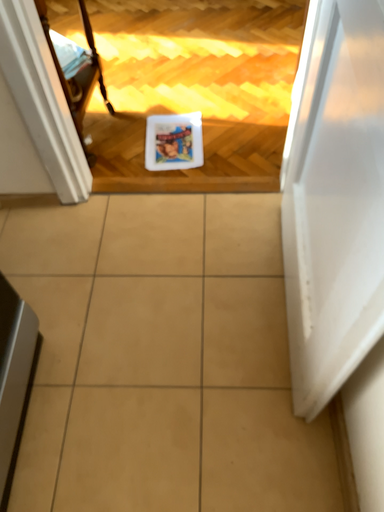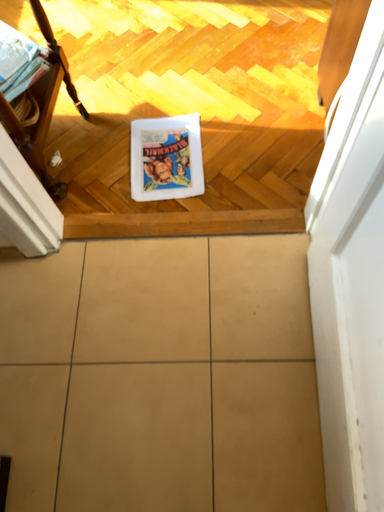
Question: How did the camera likely rotate when shooting the video?

Choices:
 (A) rotated downward
 (B) rotated upward

Answer: (A)